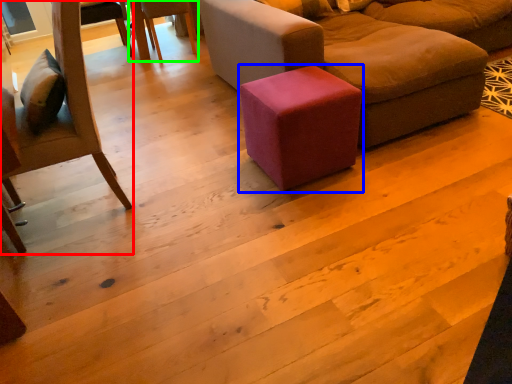
Question: Estimate the real-world distances between objects in this image. Which object is farther from chair (highlighted by a red box), stool (highlighted by a blue box) or chair (highlighted by a green box)?

Choices:
 (A) stool
 (B) chair

Answer: (B)